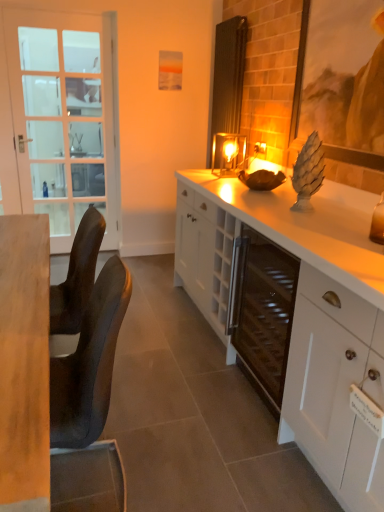
Question: Does white glass screen door at left appear on the left side of white glossy cabinet at center?

Choices:
 (A) yes
 (B) no

Answer: (A)

Question: From a real-world perspective, is white glass screen door at left positioned over white glossy cabinet at center based on gravity?

Choices:
 (A) yes
 (B) no

Answer: (A)

Question: Is white glass screen door at left at the right side of white glossy cabinet at center?

Choices:
 (A) yes
 (B) no

Answer: (B)

Question: Is white glass screen door at left outside white glossy cabinet at center?

Choices:
 (A) yes
 (B) no

Answer: (A)

Question: From a real-world perspective, is white glass screen door at left located beneath white glossy cabinet at center?

Choices:
 (A) yes
 (B) no

Answer: (B)

Question: In the image, is matte wooden picture frame at upper right on the left side or the right side of light brown wood desk at left?

Choices:
 (A) left
 (B) right

Answer: (B)

Question: Considering the positions of matte wooden picture frame at upper right and light brown wood desk at left in the image, is matte wooden picture frame at upper right taller or shorter than light brown wood desk at left?

Choices:
 (A) short
 (B) tall

Answer: (B)

Question: Considering their positions, is matte wooden picture frame at upper right located in front of or behind light brown wood desk at left?

Choices:
 (A) front
 (B) behind

Answer: (B)

Question: From a real-world perspective, is matte wooden picture frame at upper right physically located above or below light brown wood desk at left?

Choices:
 (A) below
 (B) above

Answer: (B)

Question: Considering their positions, is metallic glass candle holder at center located in front of or behind matte wooden picture frame at upper right?

Choices:
 (A) behind
 (B) front

Answer: (A)

Question: Would you say metallic glass candle holder at center is inside or outside matte wooden picture frame at upper right?

Choices:
 (A) inside
 (B) outside

Answer: (B)

Question: Is point (216, 155) closer or farther from the camera than point (307, 6)?

Choices:
 (A) closer
 (B) farther

Answer: (B)

Question: From a real-world perspective, relative to matte wooden picture frame at upper right, is metallic glass candle holder at center vertically above or below?

Choices:
 (A) below
 (B) above

Answer: (A)

Question: In the image, is white glossy cabinet at center positioned in front of or behind light brown wood desk at left?

Choices:
 (A) behind
 (B) front

Answer: (A)

Question: Is white glossy cabinet at center wider or thinner than light brown wood desk at left?

Choices:
 (A) wide
 (B) thin

Answer: (B)